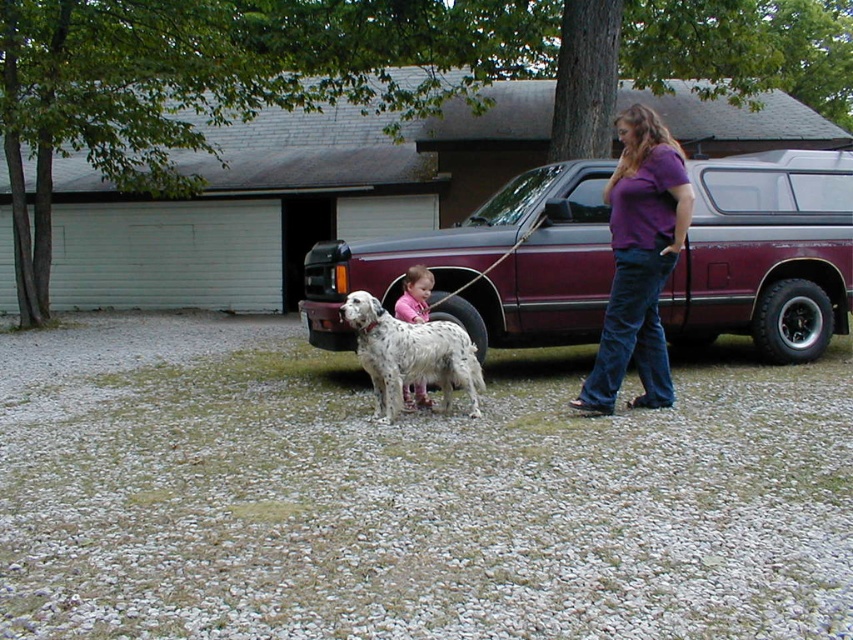
Question: Among these points, which one is nearest to the camera?

Choices:
 (A) (457, 362)
 (B) (614, 372)
 (C) (415, 390)

Answer: (B)

Question: Does purple cotton shirt at right appear on the right side of pink fabric at center?

Choices:
 (A) yes
 (B) no

Answer: (A)

Question: Which point is farther to the camera?

Choices:
 (A) (410, 280)
 (B) (355, 301)
 (C) (611, 282)

Answer: (C)

Question: Is purple cotton shirt at right above pink fabric at center?

Choices:
 (A) yes
 (B) no

Answer: (A)

Question: Can you confirm if maroon metallic pickup truck at center is positioned to the right of purple cotton shirt at right?

Choices:
 (A) no
 (B) yes

Answer: (A)

Question: Which object appears closest to the camera in this image?

Choices:
 (A) pink fabric at center
 (B) maroon metallic pickup truck at center

Answer: (A)